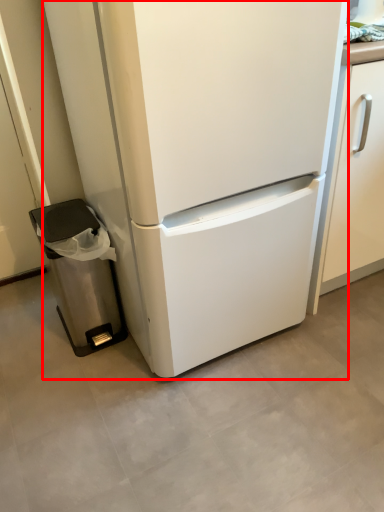
Question: In this image, where is refrigerator (annotated by the red box) located relative to trash bin/can?

Choices:
 (A) left
 (B) right

Answer: (B)